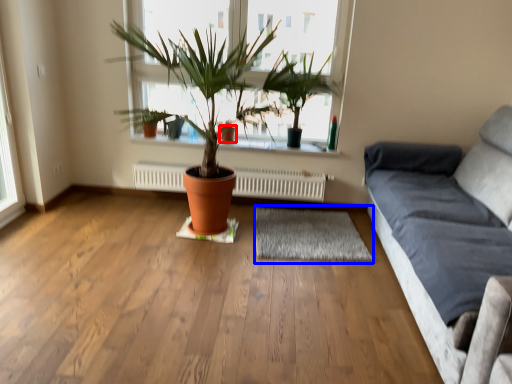
Question: Which point is further to the camera, flowerpot (highlighted by a red box) or mat (highlighted by a blue box)?

Choices:
 (A) flowerpot
 (B) mat

Answer: (A)